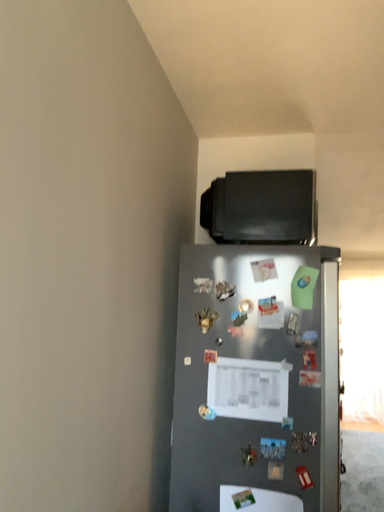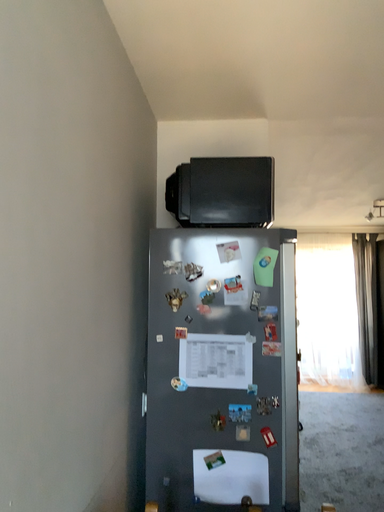
Question: Which way did the camera rotate in the video?

Choices:
 (A) rotated left
 (B) rotated right

Answer: (B)